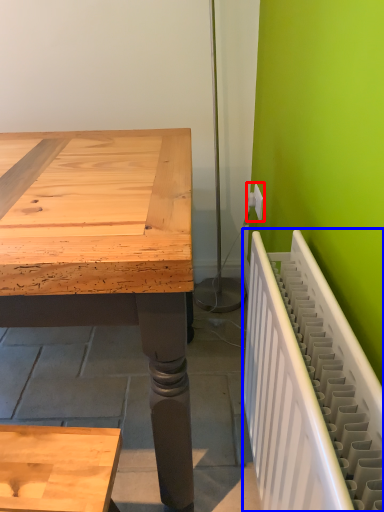
Question: Which point is closer to the camera, electric outlet (highlighted by a red box) or radiator (highlighted by a blue box)?

Choices:
 (A) electric outlet
 (B) radiator

Answer: (B)